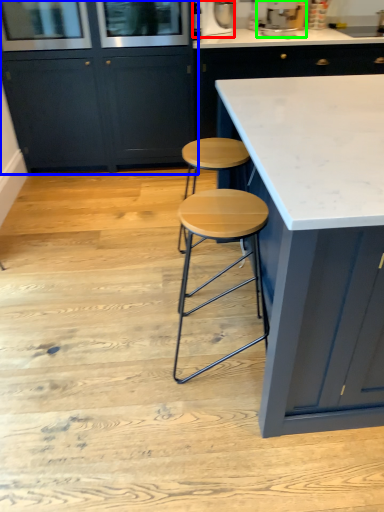
Question: Based on their relative distances, which object is farther from appliance (highlighted by a red box)? Choose from cabinetry (highlighted by a blue box) and appliance (highlighted by a green box).

Choices:
 (A) cabinetry
 (B) appliance

Answer: (A)